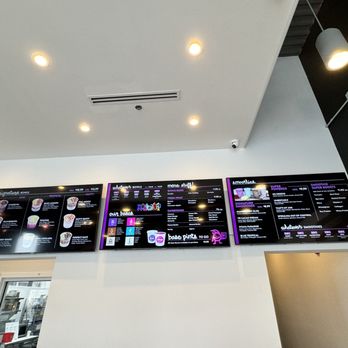
The height and width of the screenshot is (348, 348). I want to click on black wall, so click(333, 98).